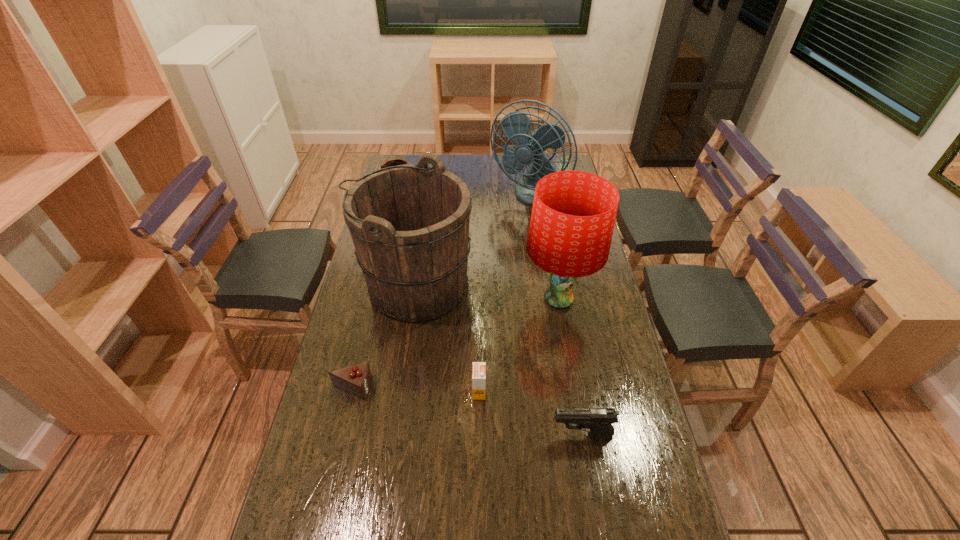
At what (x,y) coordinates should I click in order to perform the action: click on vacant space that's between the lampshade and the shortest object. Please return your answer as a coordinate pair (x, y). Looking at the image, I should click on (455, 343).

At what (x,y) coordinates should I click in order to perform the action: click on vacant area between the shortest object and the lampshade. Please return your answer as a coordinate pair (x, y). Image resolution: width=960 pixels, height=540 pixels. Looking at the image, I should click on (455, 343).

This screenshot has width=960, height=540. In order to click on empty space that is in between the bucket and the orange juice in this screenshot , I will do `click(447, 339)`.

This screenshot has height=540, width=960. I want to click on vacant area that lies between the fourth object from left to right and the fan, so click(503, 293).

Where is `free spot between the pottery and the lampshade`? free spot between the pottery and the lampshade is located at coordinates (479, 250).

Identify the location of the third closest object relative to the fan. (573, 215).

At what (x,y) coordinates should I click in order to perform the action: click on object identified as the sixth closest to the bucket. Please return your answer as a coordinate pair (x, y). The image size is (960, 540). Looking at the image, I should click on (599, 420).

Where is `blank space that satisfies the following two spatial constraints: 1. on the front-facing side of the lampshade; 2. on the front side of the fourth object from right to left`? The image size is (960, 540). blank space that satisfies the following two spatial constraints: 1. on the front-facing side of the lampshade; 2. on the front side of the fourth object from right to left is located at coordinates (574, 392).

Image resolution: width=960 pixels, height=540 pixels. I want to click on vacant position in the image that satisfies the following two spatial constraints: 1. on the back side of the bucket; 2. on the left side of the shortest object, so click(x=376, y=285).